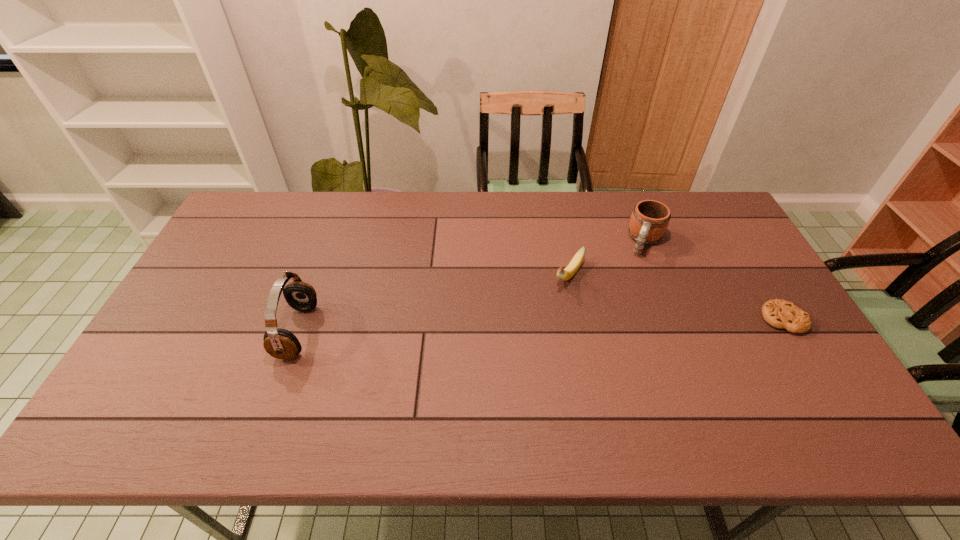
Locate an element on the screen. vacant point located between the third object from right to left and the rightmost object is located at coordinates (676, 297).

Find the location of a particular element. the third closest object to the leftmost object is located at coordinates (781, 314).

I want to click on object that ranks as the second closest to the mug, so click(x=781, y=314).